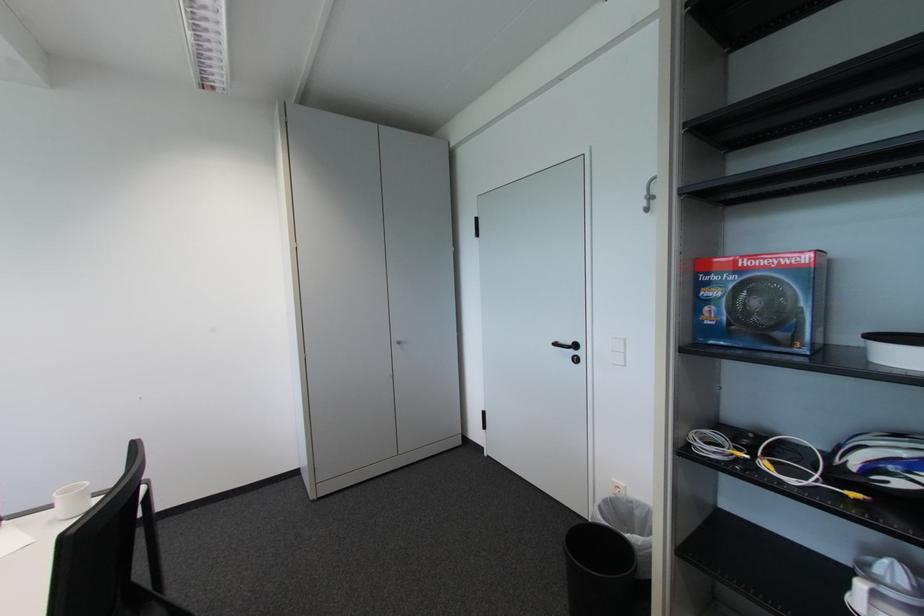
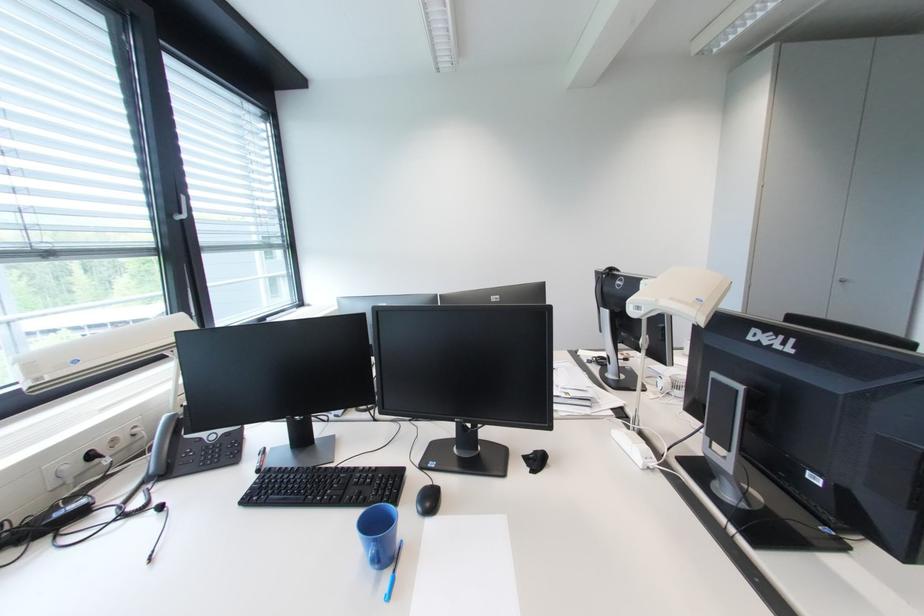
The point at (x=403, y=347) is marked in the first image. Where is the corresponding point in the second image?

(844, 285)